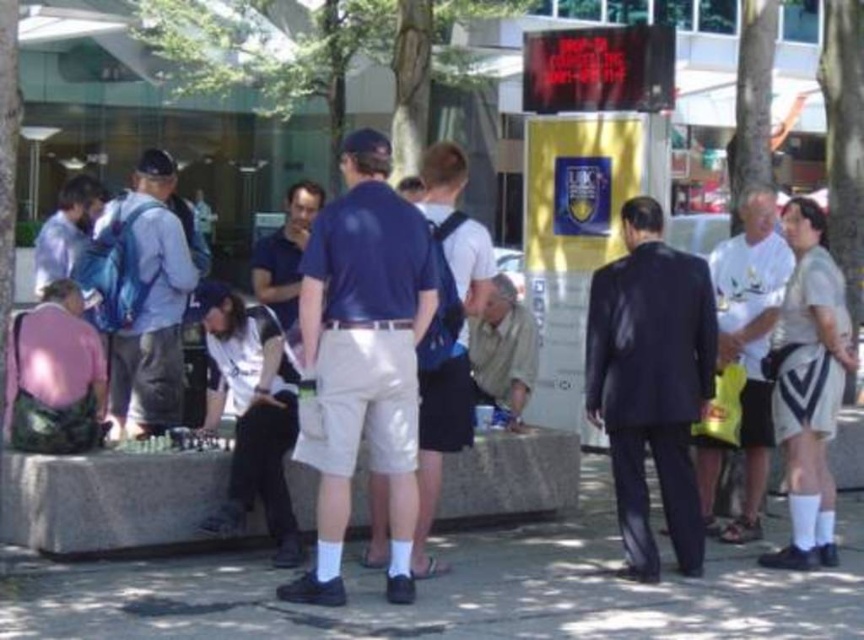
Between point (751, 586) and point (116, 378), which one is positioned behind?

Point (116, 378)

Locate an element on the screen. gray concrete pavement at center is located at coordinates (458, 589).

Which is behind, point (351, 625) or point (164, 244)?

Point (164, 244)

This screenshot has width=864, height=640. Find the location of `gray concrete pavement at center`. gray concrete pavement at center is located at coordinates (458, 589).

Looking at this image, can you confirm if dark blue leather suit at center is wider than light beige shorts at center?

Correct, the width of dark blue leather suit at center exceeds that of light beige shorts at center.

Can you confirm if dark blue leather suit at center is positioned to the right of light beige shorts at center?

Yes, dark blue leather suit at center is to the right of light beige shorts at center.

The height and width of the screenshot is (640, 864). Identify the location of dark blue leather suit at center. (651, 381).

Looking at this image, can you confirm if gray concrete pavement at center is thinner than dark blue leather suit at center?

In fact, gray concrete pavement at center might be wider than dark blue leather suit at center.

Does gray concrete pavement at center have a greater height compared to dark blue leather suit at center?

Incorrect, gray concrete pavement at center's height is not larger of dark blue leather suit at center's.

Who is more distant from viewer, [720,632] or [627,573]?

The point [627,573] is more distant.

Where is `gray concrete pavement at center`? gray concrete pavement at center is located at coordinates (458, 589).